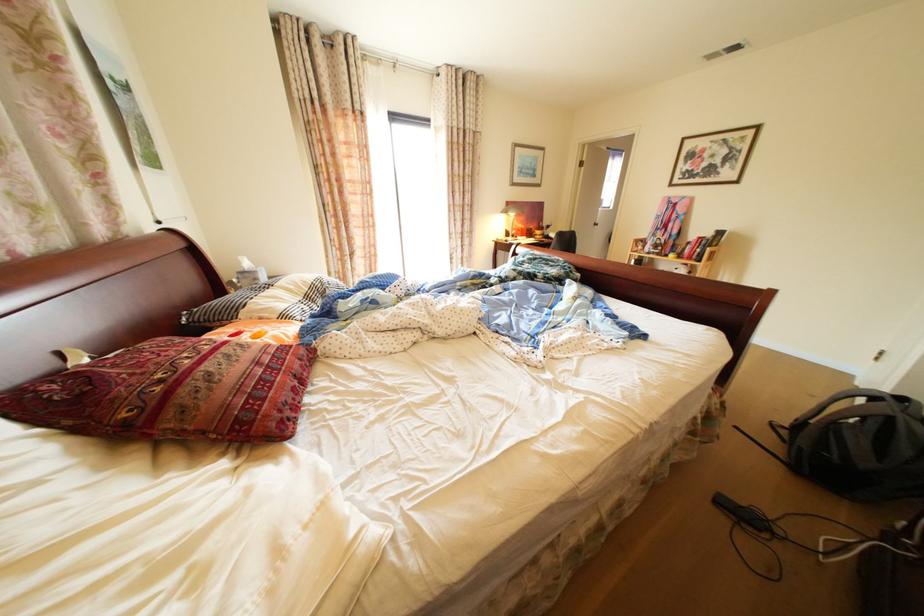
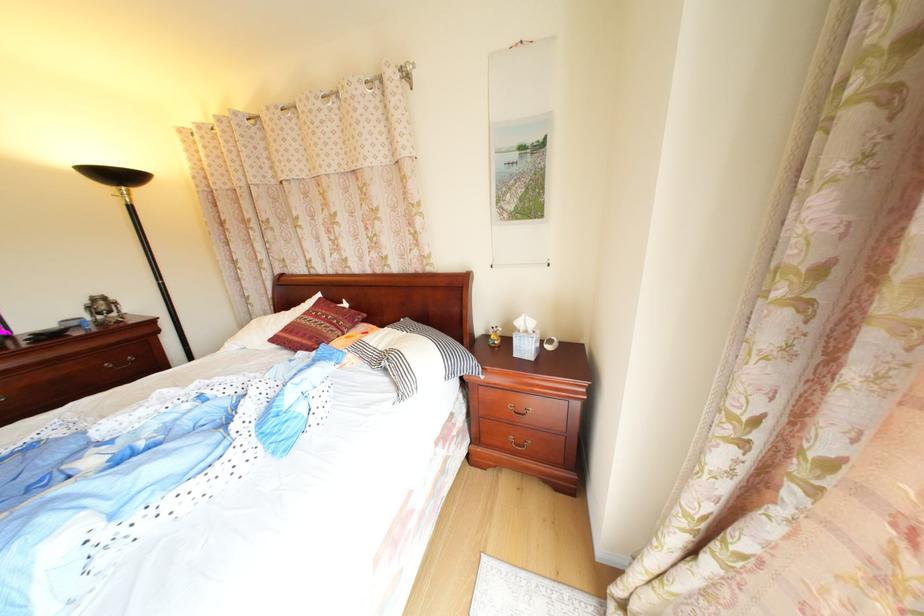
The point at (x=197, y=321) is marked in the first image. Where is the corresponding point in the second image?

(415, 322)